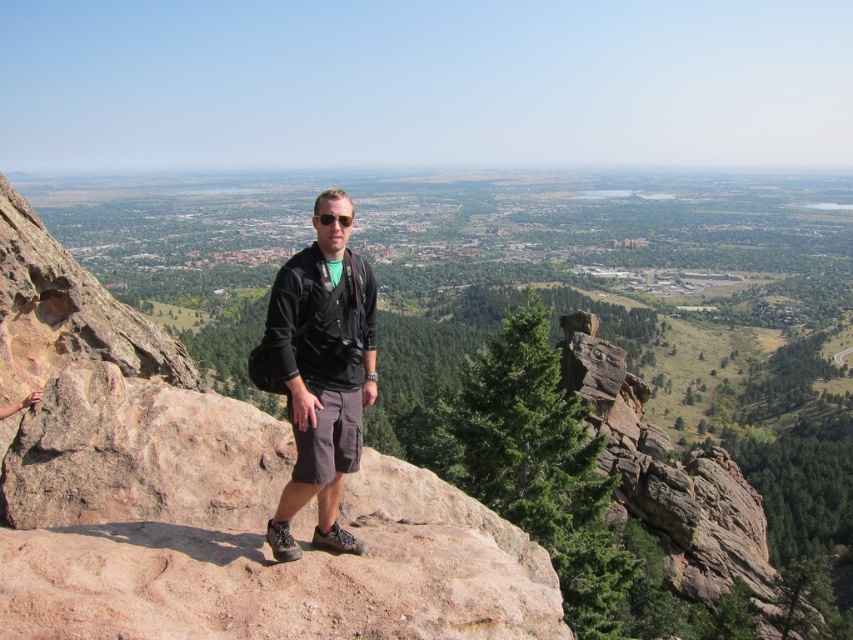
At what (x,y) coordinates should I click in order to perform the action: click on brown rough rock at center. Please return your answer as a coordinate pair (x, y). Looking at the image, I should click on (207, 497).

Is point (15, 516) more distant than point (318, 365)?

No, it is in front of (318, 365).

This screenshot has width=853, height=640. Describe the element at coordinates (207, 497) in the screenshot. I see `brown rough rock at center` at that location.

At what (x,y) coordinates should I click in order to perform the action: click on brown rough rock at center. Please return your answer as a coordinate pair (x, y). The image size is (853, 640). Looking at the image, I should click on (207, 497).

Between black fabric jacket at center and matte black sunglasses at center, which one has less height?

Standing shorter between the two is matte black sunglasses at center.

Which is above, black fabric jacket at center or matte black sunglasses at center?

Positioned higher is matte black sunglasses at center.

Find the location of a particular element. black fabric jacket at center is located at coordinates (321, 380).

Can you confirm if brown rough rock at center is wider than matte black sunglasses at center?

Correct, the width of brown rough rock at center exceeds that of matte black sunglasses at center.

Can you confirm if brown rough rock at center is shorter than matte black sunglasses at center?

No.

This screenshot has height=640, width=853. Identify the location of brown rough rock at center. (207, 497).

Where is `brown rough rock at center`? This screenshot has width=853, height=640. brown rough rock at center is located at coordinates (207, 497).